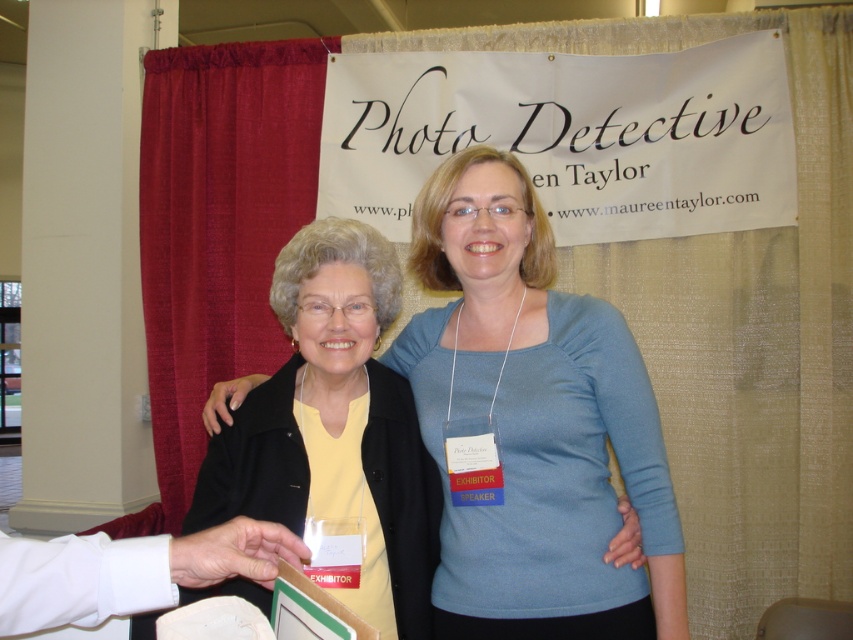
Who is more distant from viewer, (486, 180) or (300, 561)?

The point (486, 180) is behind.

What are the coordinates of `matte yellow shirt at center` in the screenshot? It's located at (531, 422).